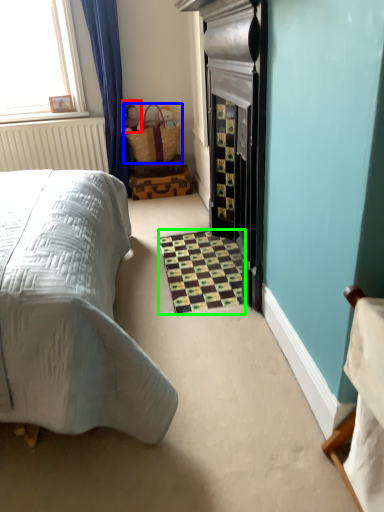
Question: Which object is positioned farthest from toy (highlighted by a red box)? Select from basket (highlighted by a blue box) and tile (highlighted by a green box).

Choices:
 (A) basket
 (B) tile

Answer: (B)